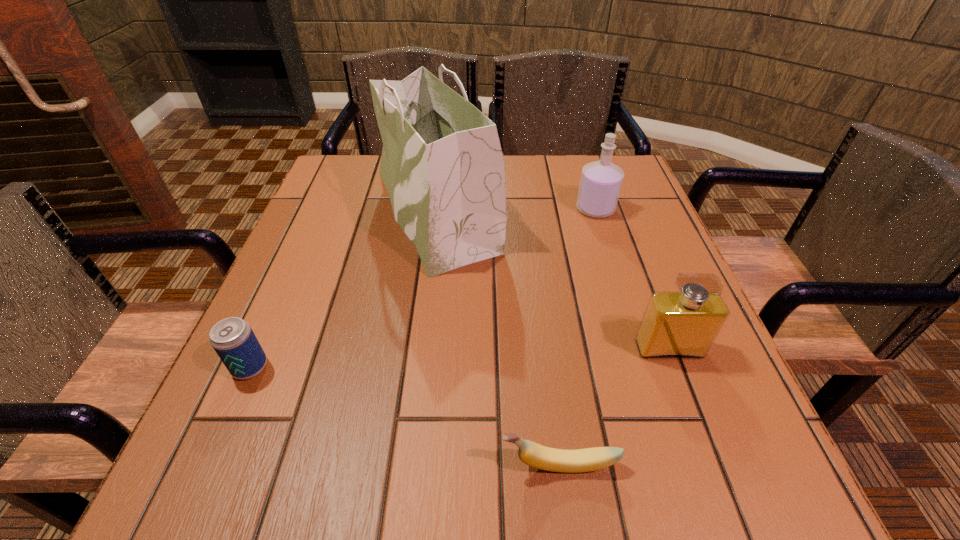
Find the location of `the tallest object`. the tallest object is located at coordinates (442, 164).

Image resolution: width=960 pixels, height=540 pixels. I want to click on the farther perfume, so click(x=600, y=184).

At what (x,y) coordinates should I click in order to perform the action: click on the nearer perfume. Please return your answer as a coordinate pair (x, y). Image resolution: width=960 pixels, height=540 pixels. Looking at the image, I should click on (675, 325).

At what (x,y) coordinates should I click in order to perform the action: click on the leftmost object. Please return your answer as a coordinate pair (x, y). Looking at the image, I should click on (233, 339).

You are a GUI agent. You are given a task and a screenshot of the screen. Output one action in this format:
    pyautogui.click(x=<x>, y=<y>)
    Task: Click on the beer can
    This screenshot has width=960, height=540.
    Given the screenshot: What is the action you would take?
    pyautogui.click(x=233, y=339)

Find the location of a particular element. Image resolution: width=960 pixels, height=540 pixels. the shortest object is located at coordinates (535, 455).

What are the coordinates of `the nearest object` in the screenshot? It's located at [x=535, y=455].

You are a GUI agent. You are given a task and a screenshot of the screen. Output one action in this format:
    pyautogui.click(x=<x>, y=<y>)
    Task: Click on the free space located 0.100m on the left of the grocery bag
    This screenshot has height=540, width=960.
    Given the screenshot: What is the action you would take?
    pyautogui.click(x=326, y=210)

What are the coordinates of `vacant area located on the left of the farther perfume` in the screenshot? It's located at (535, 209).

Where is `vacant space located 0.170m on the front-facing side of the nearer perfume`? vacant space located 0.170m on the front-facing side of the nearer perfume is located at coordinates (710, 459).